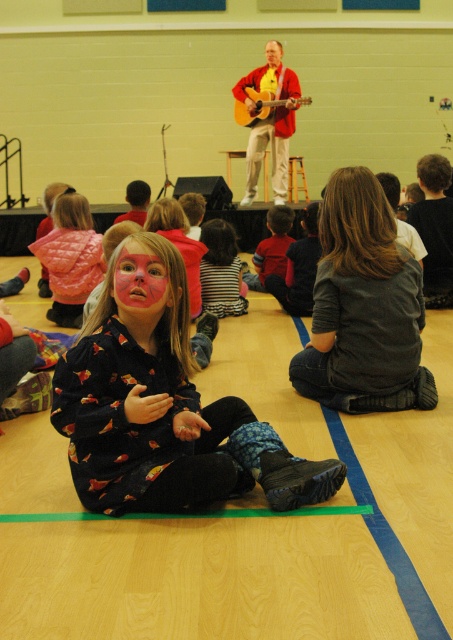
Question: Among these points, which one is farthest from the camera?

Choices:
 (A) (120, 250)
 (B) (282, 49)

Answer: (B)

Question: Is printed fabric dress at center above pink matte face paint at center?

Choices:
 (A) no
 (B) yes

Answer: (A)

Question: Which of the following is the farthest from the observer?

Choices:
 (A) (318, 323)
 (B) (73, 269)

Answer: (B)

Question: Is pink matte face paint at center to the left of smooth yellow shirt at upper center from the viewer's perspective?

Choices:
 (A) yes
 (B) no

Answer: (A)

Question: Which point is farther from the camera taking this photo?

Choices:
 (A) (64, 301)
 (B) (120, 300)

Answer: (A)

Question: From the image, what is the correct spatial relationship of dark gray sweater at center in relation to acoustic wood guitar at upper center?

Choices:
 (A) left
 (B) right

Answer: (B)